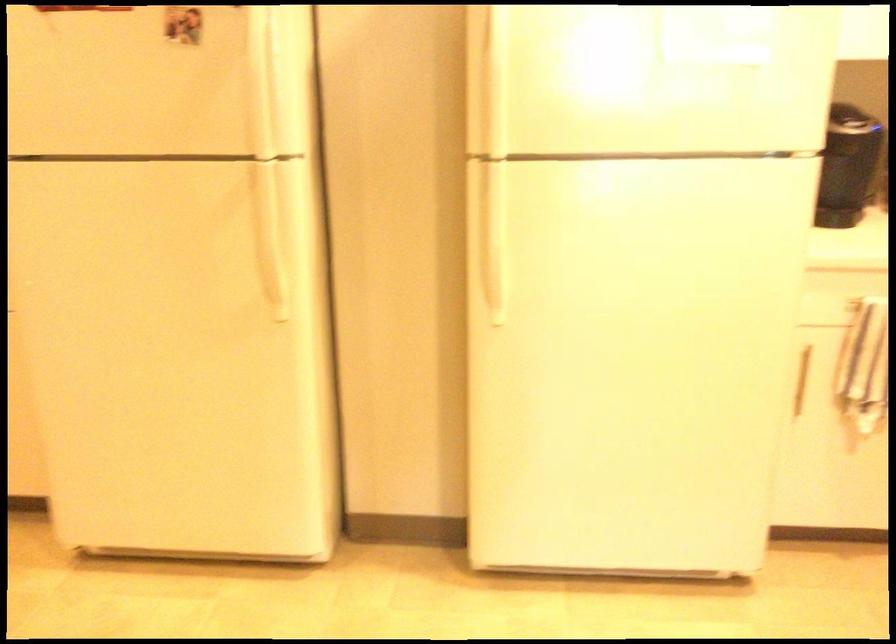
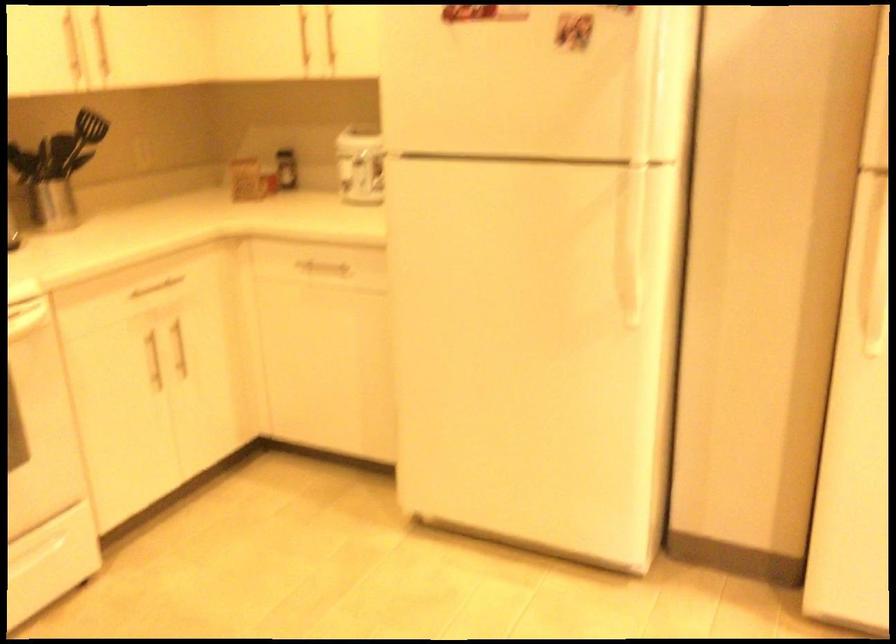
Find the pixel in the second image that matches point (265, 93) in the first image.

(642, 104)